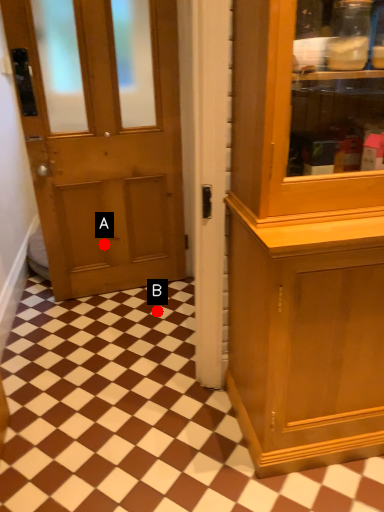
Question: Two points are circled on the image, labeled by A and B beside each circle. Which of the following is the farthest from the observer?

Choices:
 (A) A is further
 (B) B is further

Answer: (A)